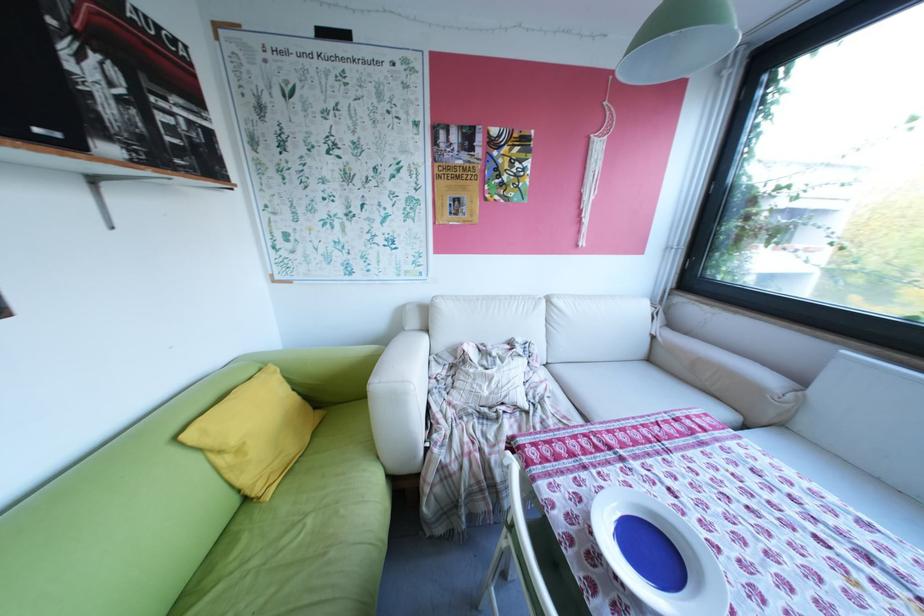
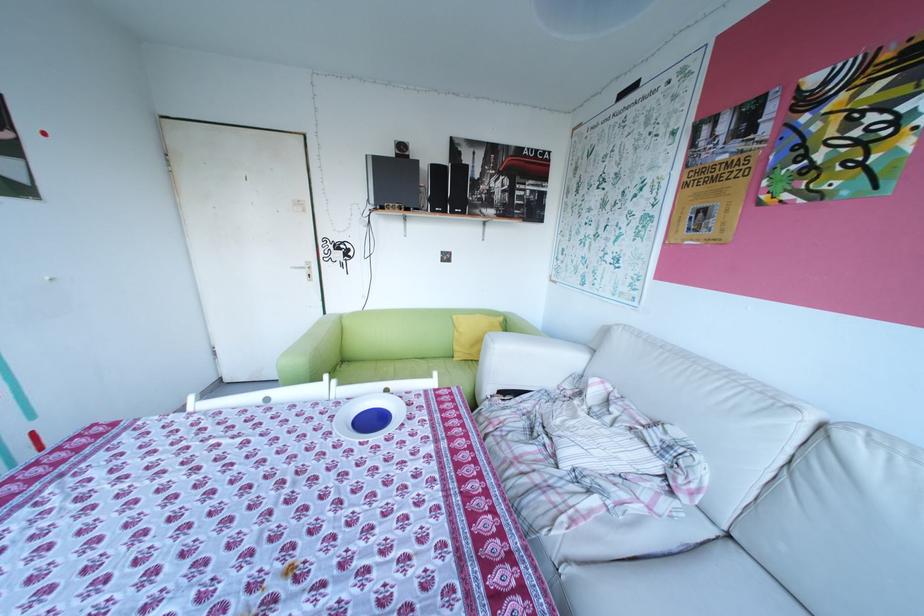
In the second image, find the point that corresponds to (x=29, y=132) in the first image.

(466, 212)